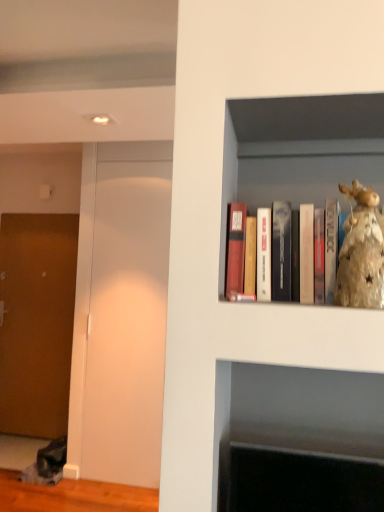
Where is `vacant area situated below transparent glass door at left (from a real-world perspective)`? The height and width of the screenshot is (512, 384). vacant area situated below transparent glass door at left (from a real-world perspective) is located at coordinates (122, 483).